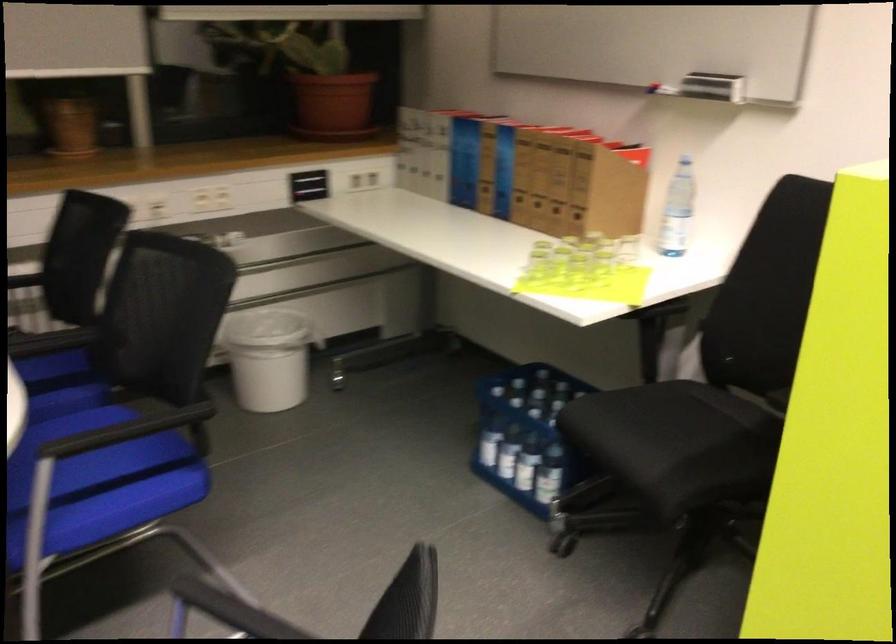
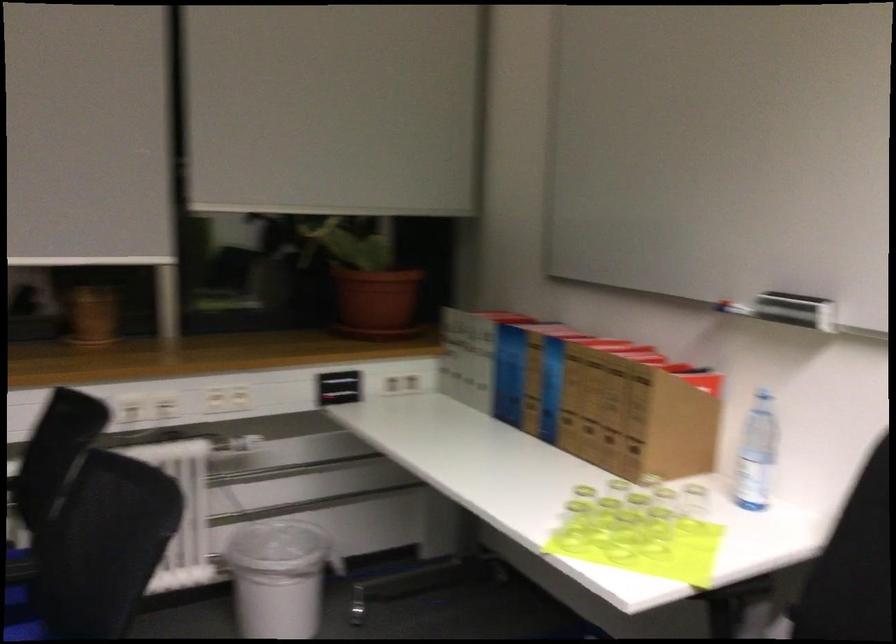
In the second image, find the point that corresponds to (x=579, y=189) in the first image.

(634, 417)